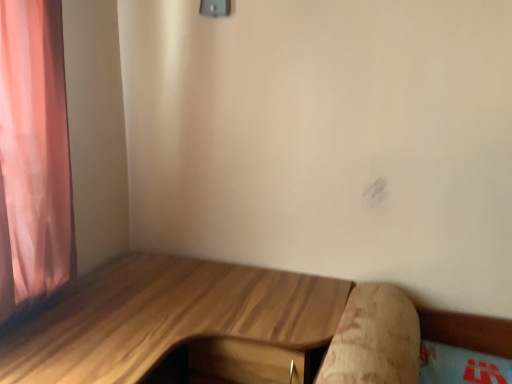
The image size is (512, 384). Find the location of `free space above wooden desk at left (from a real-world perspective)`. free space above wooden desk at left (from a real-world perspective) is located at coordinates (175, 312).